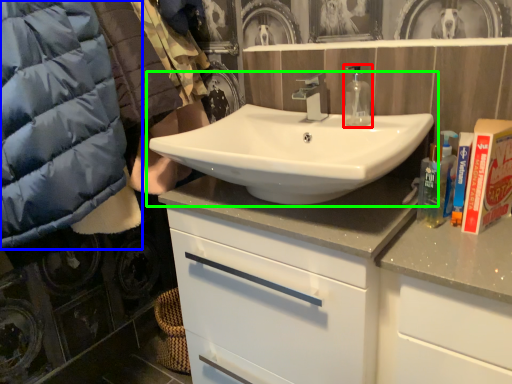
Question: Based on their relative distances, which object is farther from mouthwash (highlighted by a red box)? Choose from jacket (highlighted by a blue box) and sink (highlighted by a green box).

Choices:
 (A) jacket
 (B) sink

Answer: (A)